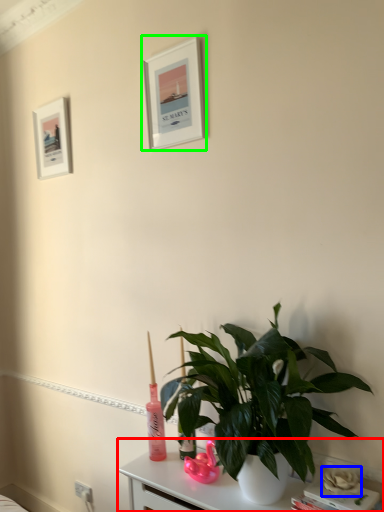
Question: Considering the real-world distances, which object is farthest from table (highlighted by a red box)? flower (highlighted by a blue box) or picture frame (highlighted by a green box)?

Choices:
 (A) flower
 (B) picture frame

Answer: (B)